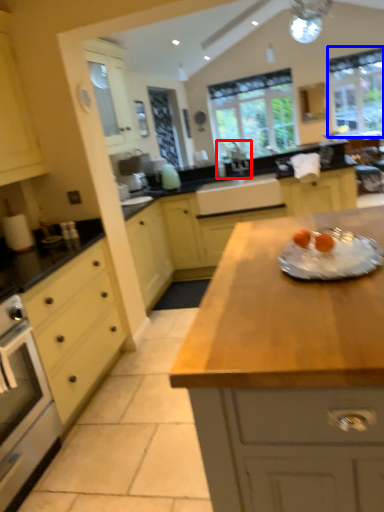
Question: Which point is further to the camera, sink (highlighted by a red box) or window (highlighted by a blue box)?

Choices:
 (A) sink
 (B) window

Answer: (B)